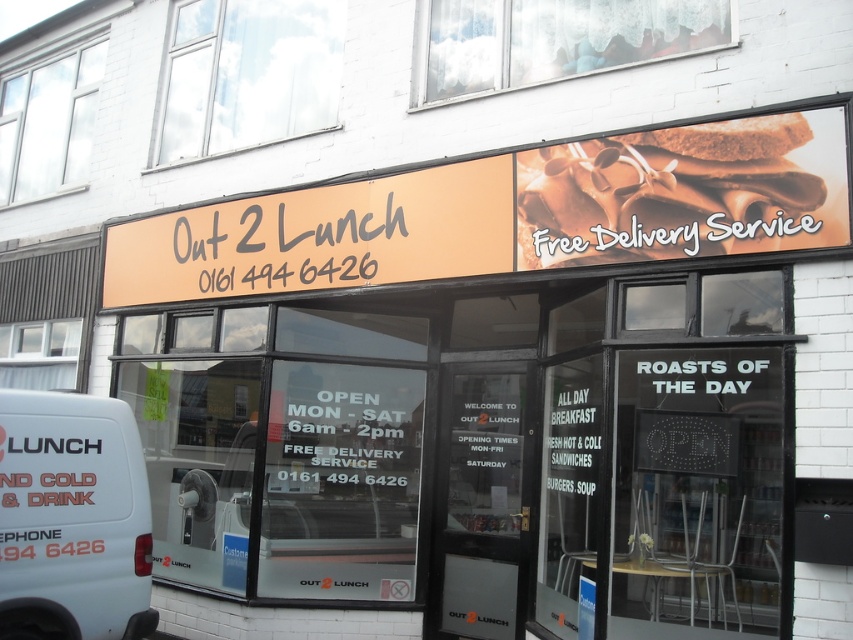
Is chocolate matte sandwich at upper right to the left of white matte van at lower left from the viewer's perspective?

In fact, chocolate matte sandwich at upper right is to the right of white matte van at lower left.

This screenshot has width=853, height=640. What do you see at coordinates (688, 192) in the screenshot? I see `chocolate matte sandwich at upper right` at bounding box center [688, 192].

Between point (746, 166) and point (0, 394), which one is positioned behind?

Positioned behind is point (746, 166).

What are the coordinates of `chocolate matte sandwich at upper right` in the screenshot? It's located at (688, 192).